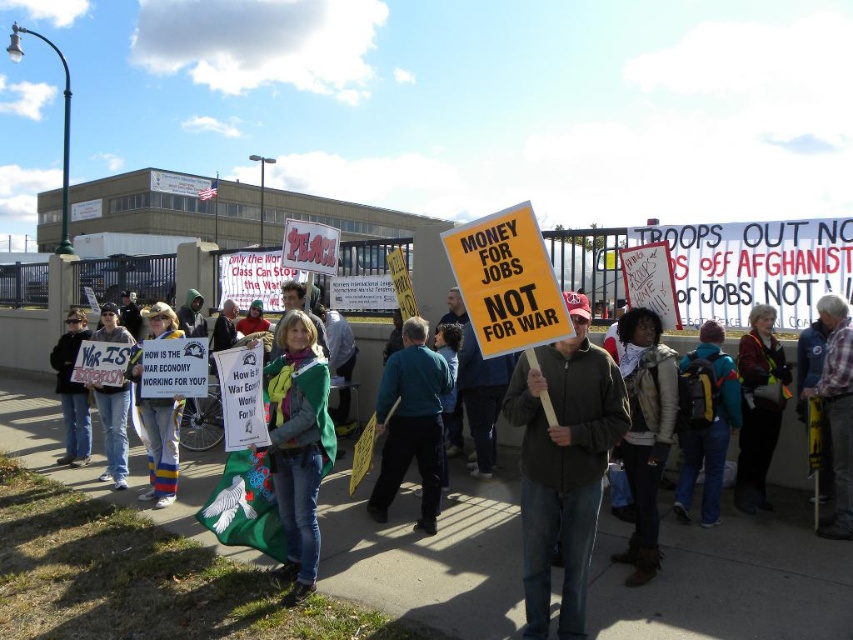
Question: Which of the following is the farthest from the observer?

Choices:
 (A) (641, 374)
 (B) (846, 326)
 (C) (708, 328)

Answer: (C)

Question: Is green fabric flag at center smaller than leather jacket at center?

Choices:
 (A) yes
 (B) no

Answer: (A)

Question: Is green fabric flag at center to the right of teal fabric jacket at center from the viewer's perspective?

Choices:
 (A) no
 (B) yes

Answer: (A)

Question: Based on their relative distances, which object is farther from the green fabric jacket at center?

Choices:
 (A) green fabric flag at center
 (B) knitted wool hat at center
 (C) maroon fabric jacket at center

Answer: (C)

Question: Can you confirm if plaid shirt at center is positioned above knitted wool hat at center?

Choices:
 (A) yes
 (B) no

Answer: (A)

Question: Which of the following is the farthest from the observer?

Choices:
 (A) blue fleece jacket at center
 (B) denim jacket at lower left
 (C) knitted wool hat at center
 (D) maroon fabric jacket at center

Answer: (B)